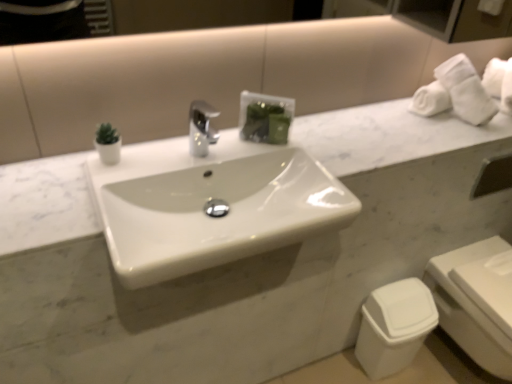
Question: Can you confirm if white glossy sink at center is positioned to the right of white plastic toilet bowl at lower right?

Choices:
 (A) no
 (B) yes

Answer: (A)

Question: Is white glossy sink at center shorter than white plastic toilet bowl at lower right?

Choices:
 (A) yes
 (B) no

Answer: (A)

Question: Is white glossy sink at center positioned beyond the bounds of white plastic toilet bowl at lower right?

Choices:
 (A) yes
 (B) no

Answer: (A)

Question: Considering the relative sizes of white glossy sink at center and white plastic toilet bowl at lower right in the image provided, is white glossy sink at center wider than white plastic toilet bowl at lower right?

Choices:
 (A) yes
 (B) no

Answer: (A)

Question: Does white glossy sink at center turn towards white plastic toilet bowl at lower right?

Choices:
 (A) no
 (B) yes

Answer: (A)

Question: From a real-world perspective, is white glossy sink at center below white plastic toilet bowl at lower right?

Choices:
 (A) yes
 (B) no

Answer: (B)

Question: From the image's perspective, would you say white plastic toilet bowl at lower right is shown under white plastic toilet at lower right?

Choices:
 (A) no
 (B) yes

Answer: (B)

Question: Is white plastic toilet bowl at lower right not near white plastic toilet at lower right?

Choices:
 (A) no
 (B) yes

Answer: (A)

Question: Is white plastic toilet bowl at lower right further to camera compared to white plastic toilet at lower right?

Choices:
 (A) no
 (B) yes

Answer: (B)

Question: From a real-world perspective, is white plastic toilet bowl at lower right under white plastic toilet at lower right?

Choices:
 (A) no
 (B) yes

Answer: (B)

Question: Does white plastic toilet bowl at lower right have a lesser height compared to white plastic toilet at lower right?

Choices:
 (A) no
 (B) yes

Answer: (B)

Question: Are white plastic toilet bowl at lower right and white plastic toilet at lower right beside each other?

Choices:
 (A) yes
 (B) no

Answer: (B)

Question: Considering the relative sizes of white plastic toilet at lower right and white glossy sink at center in the image provided, is white plastic toilet at lower right bigger than white glossy sink at center?

Choices:
 (A) no
 (B) yes

Answer: (B)